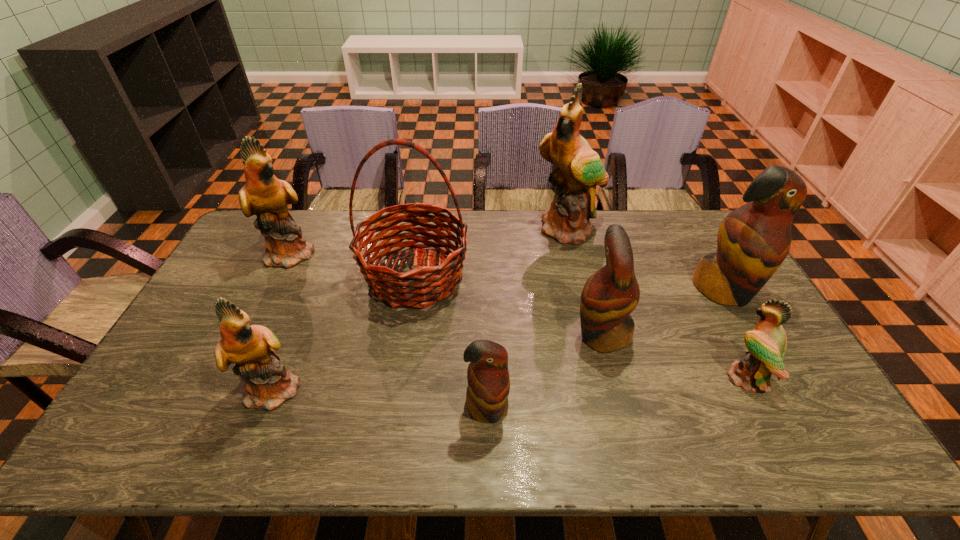
This screenshot has height=540, width=960. Find the location of `free space that satisfies the following two spatial constraints: 1. on the face of the biggest red parrot; 2. on the face of the second red parrot from left to right`. free space that satisfies the following two spatial constraints: 1. on the face of the biggest red parrot; 2. on the face of the second red parrot from left to right is located at coordinates (749, 334).

Image resolution: width=960 pixels, height=540 pixels. I want to click on blank space that satisfies the following two spatial constraints: 1. on the front-facing side of the second green parrot from right to left; 2. on the front-facing side of the third biggest green parrot, so click(606, 388).

Locate an element on the screen. vacant region that satisfies the following two spatial constraints: 1. on the face of the biggest red parrot; 2. on the front-facing side of the second smallest green parrot is located at coordinates (780, 388).

This screenshot has height=540, width=960. In order to click on vacant position in the image that satisfies the following two spatial constraints: 1. on the face of the farthest red parrot; 2. on the front-facing side of the third biggest green parrot in this screenshot , I will do `click(780, 388)`.